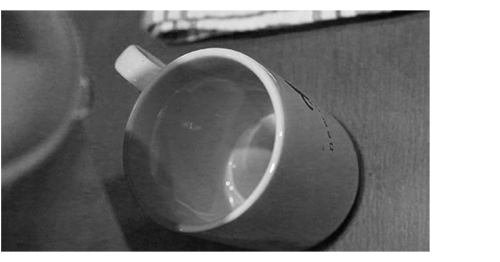
Find the location of a particular element. The image size is (500, 262). pot is located at coordinates (102, 212).